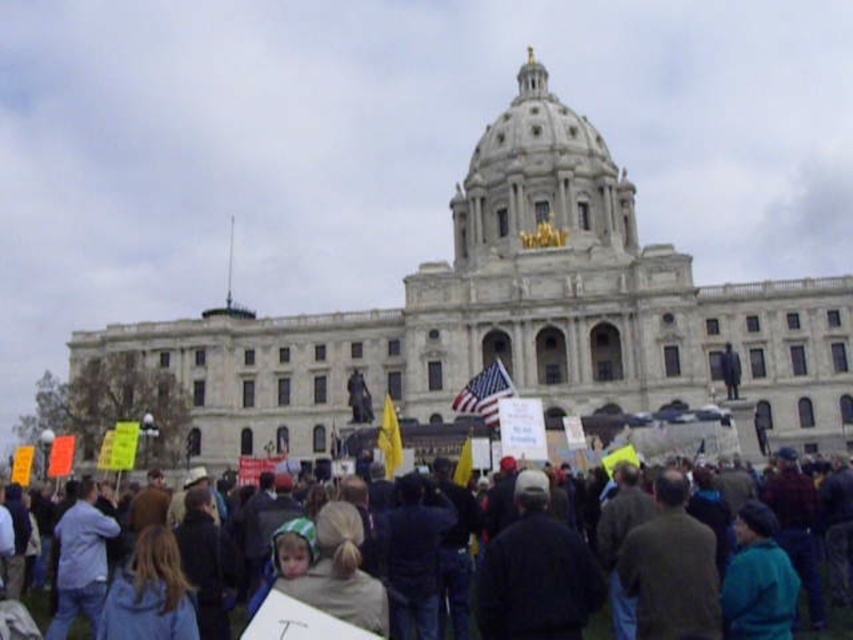
Who is lower down, dark blue jackets at center or american flag at center?

dark blue jackets at center is lower down.

Between dark blue jackets at center and american flag at center, which one has less height?

dark blue jackets at center is shorter.

Is point (473, 608) positioned after point (480, 385)?

No, (473, 608) is closer to viewer.

Image resolution: width=853 pixels, height=640 pixels. Find the location of `dark blue jackets at center`. dark blue jackets at center is located at coordinates (827, 621).

Which is behind, point (483, 369) or point (389, 435)?

The point (483, 369) is behind.

Can you confirm if american flag at center is smaller than yellow fabric flag at center?

Incorrect, american flag at center is not smaller in size than yellow fabric flag at center.

Who is more distant from viewer, (492,410) or (399,456)?

The point (492,410) is behind.

The height and width of the screenshot is (640, 853). What are the coordinates of `american flag at center` in the screenshot? It's located at (485, 392).

Is dark blue jackets at center positioned in front of yellow fabric flag at center?

Yes, it is in front of yellow fabric flag at center.

Does dark blue jackets at center appear under yellow fabric flag at center?

Indeed, dark blue jackets at center is positioned under yellow fabric flag at center.

Who is more forward, (78,632) or (389,445)?

Point (78,632) is in front.

Find the location of a particular element. This screenshot has width=853, height=640. dark blue jackets at center is located at coordinates (827, 621).